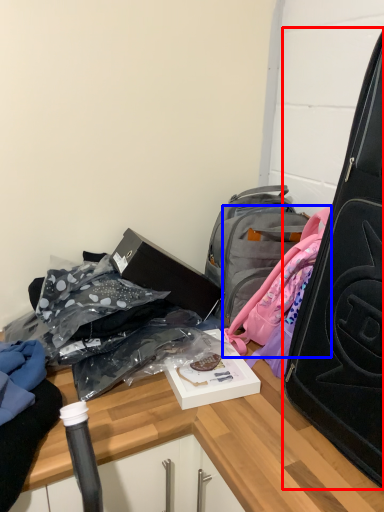
Question: Among these objects, which one is farthest to the camera, suitcase (highlighted by a red box) or backpack (highlighted by a blue box)?

Choices:
 (A) suitcase
 (B) backpack

Answer: (B)